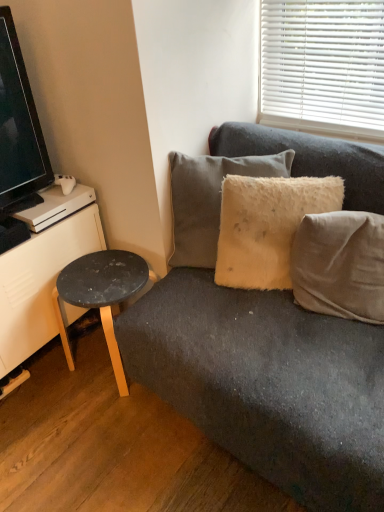
In order to face beige cotton cushion at right, the 3th pillow viewed from the left, should I rotate leftwards or rightwards?

You should look right and rotate roughly 19.471 degrees.

Measure the distance between fuzzy yellow pillow at center, which appears as the 2th pillow when viewed from the left, and camera.

fuzzy yellow pillow at center, which appears as the 2th pillow when viewed from the left, is 4.69 feet from camera.

Where is `black glossy tv at left`? The image size is (384, 512). black glossy tv at left is located at coordinates (19, 128).

Is fuzzy beige pillow at upper right, which is the third pillow in right-to-left order, not near fuzzy yellow pillow at center, arranged as the second pillow when viewed from the right?

No, fuzzy beige pillow at upper right, which is the third pillow in right-to-left order, is not far away from fuzzy yellow pillow at center, arranged as the second pillow when viewed from the right.

From a real-world perspective, who is located lower, fuzzy beige pillow at upper right, marked as the 1th pillow in a left-to-right arrangement, or fuzzy yellow pillow at center, arranged as the second pillow when viewed from the right?

fuzzy yellow pillow at center, arranged as the second pillow when viewed from the right, is physically lower.

How many degrees apart are the facing directions of fuzzy beige pillow at upper right, marked as the 1th pillow in a left-to-right arrangement, and fuzzy yellow pillow at center, arranged as the second pillow when viewed from the right?

They differ by 9.43 degrees in their facing directions.

Considering the relative positions of black laminate stool at lower left and beige cotton cushion at right, the 3th pillow viewed from the left, in the image provided, is black laminate stool at lower left to the left of beige cotton cushion at right, the 3th pillow viewed from the left, from the viewer's perspective?

Yes, black laminate stool at lower left is to the left of beige cotton cushion at right, the 3th pillow viewed from the left.

You are a GUI agent. You are given a task and a screenshot of the screen. Output one action in this format:
    pyautogui.click(x=<x>, y=<y>)
    Task: Click on the pillow that is the 3rd one when counting rightward from the black laminate stool at lower left
    This screenshot has height=512, width=384.
    Given the screenshot: What is the action you would take?
    pyautogui.click(x=340, y=265)

Is point (97, 302) behind point (372, 289)?

Yes, it is behind point (372, 289).

Can you tell me how much black laminate stool at lower left and beige cotton cushion at right, acting as the 1th pillow starting from the right, differ in facing direction?

black laminate stool at lower left and beige cotton cushion at right, acting as the 1th pillow starting from the right, are facing 17.4 degrees away from each other.

Is beige cotton cushion at right, acting as the 1th pillow starting from the right, at the back of white matte dresser at left?

No, white matte dresser at left is not facing the opposite direction of beige cotton cushion at right, acting as the 1th pillow starting from the right.

From a real-world perspective, is white matte dresser at left over beige cotton cushion at right, the 3th pillow viewed from the left?

Incorrect, from a real-world perspective, white matte dresser at left is lower than beige cotton cushion at right, the 3th pillow viewed from the left.

Does white matte dresser at left appear on the left side of beige cotton cushion at right, the 3th pillow viewed from the left?

Yes, white matte dresser at left is to the left of beige cotton cushion at right, the 3th pillow viewed from the left.

You are a GUI agent. You are given a task and a screenshot of the screen. Output one action in this format:
    pyautogui.click(x=<x>, y=<y>)
    Task: Click on the dresser located on the left of beige cotton cushion at right, acting as the 1th pillow starting from the right
    
    Given the screenshot: What is the action you would take?
    pyautogui.click(x=40, y=283)

How different are the orientations of black glossy tv at left and fuzzy beige pillow at upper right, marked as the 1th pillow in a left-to-right arrangement, in degrees?

The angle between the facing direction of black glossy tv at left and the facing direction of fuzzy beige pillow at upper right, marked as the 1th pillow in a left-to-right arrangement, is 59.1 degrees.

Which object is further away from the camera taking this photo, black glossy tv at left or fuzzy beige pillow at upper right, which is the third pillow in right-to-left order?

fuzzy beige pillow at upper right, which is the third pillow in right-to-left order, is further from the camera.

Considering the relative positions of black glossy tv at left and fuzzy beige pillow at upper right, which is the third pillow in right-to-left order, in the image provided, is black glossy tv at left to the left or to the right of fuzzy beige pillow at upper right, which is the third pillow in right-to-left order,?

black glossy tv at left is to the left of fuzzy beige pillow at upper right, which is the third pillow in right-to-left order.

Where is `pillow that is the 3rd one when counting backward from the black glossy tv at left`? The width and height of the screenshot is (384, 512). pillow that is the 3rd one when counting backward from the black glossy tv at left is located at coordinates (209, 200).

Is black glossy tv at left positioned beyond the bounds of beige cotton cushion at right, the 3th pillow viewed from the left?

That's correct, black glossy tv at left is outside of beige cotton cushion at right, the 3th pillow viewed from the left.

Is black glossy tv at left to the left or to the right of beige cotton cushion at right, acting as the 1th pillow starting from the right, in the image?

black glossy tv at left is positioned on beige cotton cushion at right, acting as the 1th pillow starting from the right,'s left side.

Considering the sizes of objects black glossy tv at left and beige cotton cushion at right, the 3th pillow viewed from the left, in the image provided, who is wider, black glossy tv at left or beige cotton cushion at right, the 3th pillow viewed from the left,?

beige cotton cushion at right, the 3th pillow viewed from the left.

Consider the image. From the image's perspective, is black glossy tv at left on beige cotton cushion at right, the 3th pillow viewed from the left?

Yes.

From the image's perspective, is black glossy tv at left under black laminate stool at lower left?

No.

Considering the sizes of objects black glossy tv at left and black laminate stool at lower left in the image provided, who is thinner, black glossy tv at left or black laminate stool at lower left?

black glossy tv at left is thinner.

Is the position of black glossy tv at left more distant than that of black laminate stool at lower left?

No, the depth of black glossy tv at left is less than that of black laminate stool at lower left.

What's the angular difference between black glossy tv at left and black laminate stool at lower left's facing directions?

The angular difference between black glossy tv at left and black laminate stool at lower left is 88.3 degrees.

In the scene shown: Which is farther from the camera, [85,297] or [249,223]?

The point [85,297] is farther from the camera.

Based on the photo, does black laminate stool at lower left have a smaller size compared to fuzzy yellow pillow at center, arranged as the second pillow when viewed from the right?

Actually, black laminate stool at lower left might be larger than fuzzy yellow pillow at center, arranged as the second pillow when viewed from the right.

This screenshot has height=512, width=384. In order to click on table below the fuzzy yellow pillow at center, which appears as the 2th pillow when viewed from the left (from a real-world perspective) in this screenshot , I will do `click(100, 296)`.

Could you tell me if black laminate stool at lower left is turned towards fuzzy yellow pillow at center, arranged as the second pillow when viewed from the right?

No.

This screenshot has width=384, height=512. Find the location of `the 1st pillow in front when counting from the fuzzy beige pillow at upper right, marked as the 1th pillow in a left-to-right arrangement`. the 1st pillow in front when counting from the fuzzy beige pillow at upper right, marked as the 1th pillow in a left-to-right arrangement is located at coordinates (267, 226).

Find the location of `table on the left of beige cotton cushion at right, acting as the 1th pillow starting from the right`. table on the left of beige cotton cushion at right, acting as the 1th pillow starting from the right is located at coordinates (100, 296).

Based on their spatial positions, is black glossy tv at left or fuzzy beige pillow at upper right, marked as the 1th pillow in a left-to-right arrangement, further from beige cotton cushion at right, the 3th pillow viewed from the left?

black glossy tv at left lies further to beige cotton cushion at right, the 3th pillow viewed from the left, than the other object.

From the image, which object appears to be nearer to fuzzy yellow pillow at center, which appears as the 2th pillow when viewed from the left, black laminate stool at lower left or black glossy tv at left?

black laminate stool at lower left lies closer to fuzzy yellow pillow at center, which appears as the 2th pillow when viewed from the left, than the other object.

Which object lies nearer to the anchor point fuzzy beige pillow at upper right, which is the third pillow in right-to-left order, beige cotton cushion at right, the 3th pillow viewed from the left, or black laminate stool at lower left?

The object closer to fuzzy beige pillow at upper right, which is the third pillow in right-to-left order, is black laminate stool at lower left.

When comparing their distances from black glossy tv at left, does fuzzy yellow pillow at center, arranged as the second pillow when viewed from the right, or black laminate stool at lower left seem further?

fuzzy yellow pillow at center, arranged as the second pillow when viewed from the right, lies further to black glossy tv at left than the other object.

Looking at the image, which one is located closer to black laminate stool at lower left, white matte dresser at left or beige cotton cushion at right, acting as the 1th pillow starting from the right?

white matte dresser at left is positioned closer to the anchor black laminate stool at lower left.

From the picture: When comparing their distances from black glossy tv at left, does fuzzy beige pillow at upper right, which is the third pillow in right-to-left order, or white matte dresser at left seem closer?

The object closer to black glossy tv at left is white matte dresser at left.

When comparing their distances from white matte dresser at left, does fuzzy yellow pillow at center, which appears as the 2th pillow when viewed from the left, or fuzzy beige pillow at upper right, marked as the 1th pillow in a left-to-right arrangement, seem further?

fuzzy yellow pillow at center, which appears as the 2th pillow when viewed from the left, lies further to white matte dresser at left than the other object.

Based on their spatial positions, is black laminate stool at lower left or fuzzy beige pillow at upper right, marked as the 1th pillow in a left-to-right arrangement, closer to beige cotton cushion at right, the 3th pillow viewed from the left?

fuzzy beige pillow at upper right, marked as the 1th pillow in a left-to-right arrangement, is closer to beige cotton cushion at right, the 3th pillow viewed from the left.

This screenshot has width=384, height=512. I want to click on television between white matte dresser at left and beige cotton cushion at right, the 3th pillow viewed from the left, from left to right, so click(x=19, y=128).

Locate an element on the screen. This screenshot has height=512, width=384. table between black glossy tv at left and fuzzy yellow pillow at center, which appears as the 2th pillow when viewed from the left is located at coordinates (100, 296).

The height and width of the screenshot is (512, 384). What are the coordinates of `table situated between white matte dresser at left and fuzzy yellow pillow at center, which appears as the 2th pillow when viewed from the left, from left to right` in the screenshot? It's located at (100, 296).

At what (x,y) coordinates should I click in order to perform the action: click on pillow between fuzzy beige pillow at upper right, marked as the 1th pillow in a left-to-right arrangement, and beige cotton cushion at right, acting as the 1th pillow starting from the right, from left to right. Please return your answer as a coordinate pair (x, y). This screenshot has width=384, height=512. Looking at the image, I should click on (267, 226).